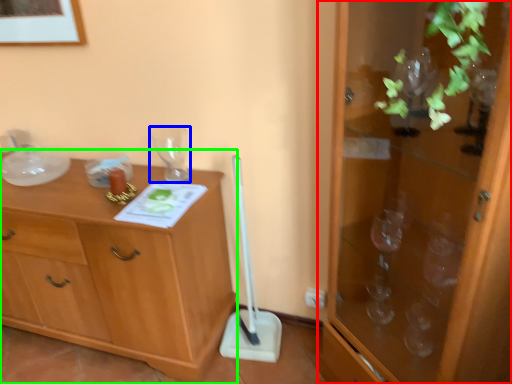
Question: Estimate the real-world distances between objects in this image. Which object is farther from cabinetry (highlighted by a red box), glass vase (highlighted by a blue box) or chest of drawers (highlighted by a green box)?

Choices:
 (A) glass vase
 (B) chest of drawers

Answer: (A)